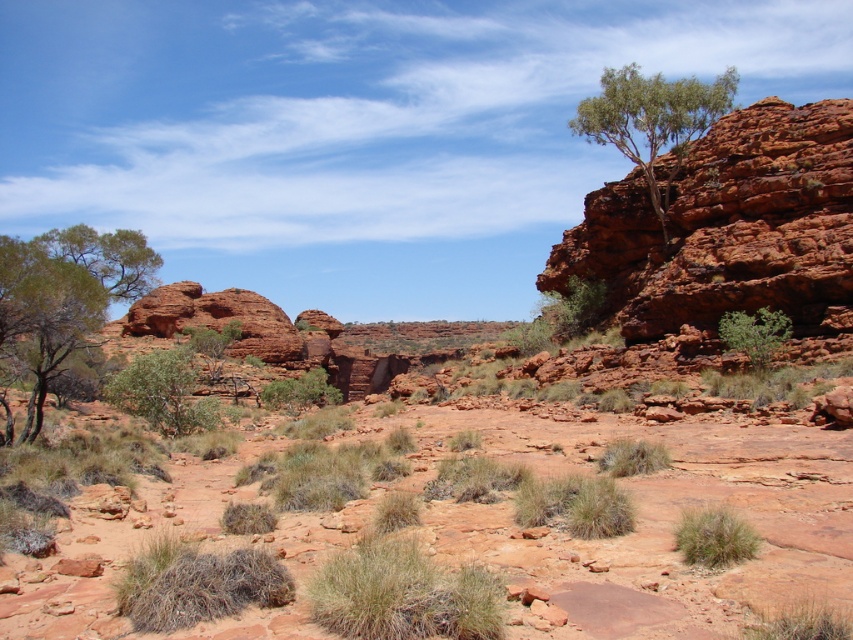
Consider the image. Does green leafy tree at left appear over green leafy tree at upper right?

No.

Is green leafy tree at left to the left of green leafy tree at upper right from the viewer's perspective?

Correct, you'll find green leafy tree at left to the left of green leafy tree at upper right.

Is point (10, 340) positioned before point (657, 131)?

Yes, point (10, 340) is closer to viewer.

The image size is (853, 640). What are the coordinates of `green leafy tree at left` in the screenshot? It's located at (62, 298).

Who is positioned more to the right, green leafy tree at center or green grassy bush at center?

green grassy bush at center

You are a GUI agent. You are given a task and a screenshot of the screen. Output one action in this format:
    pyautogui.click(x=<x>, y=<y>)
    Task: Click on the green leafy tree at center
    The image size is (853, 640).
    Given the screenshot: What is the action you would take?
    pyautogui.click(x=163, y=392)

In order to click on green leafy tree at center in this screenshot , I will do `click(163, 392)`.

Between green leafy tree at center and green leafy shrub at center-right, which one is positioned higher?

green leafy shrub at center-right is higher up.

Is green leafy tree at center to the right of green leafy shrub at center-right from the viewer's perspective?

In fact, green leafy tree at center is to the left of green leafy shrub at center-right.

Which is in front, point (187, 429) or point (770, 348)?

Point (770, 348) is in front.

The height and width of the screenshot is (640, 853). In order to click on green leafy tree at center in this screenshot , I will do (x=163, y=392).